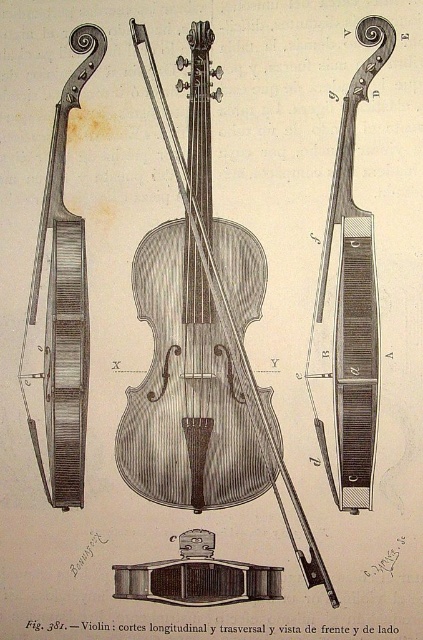
Question: Which object appears farthest from the camera in this image?

Choices:
 (A) matte wood violin at left
 (B) wooden violin at right
 (C) wooden violin at center

Answer: (A)

Question: Is wooden violin at center positioned in front of wooden violin at right?

Choices:
 (A) no
 (B) yes

Answer: (A)

Question: Does wooden violin at center have a lesser width compared to wooden violin at right?

Choices:
 (A) yes
 (B) no

Answer: (B)

Question: Which of these objects is positioned closest to the wooden violin at right?

Choices:
 (A) matte wood violin at left
 (B) wooden violin at center

Answer: (B)

Question: Observing the image, what is the correct spatial positioning of wooden violin at center in reference to wooden violin at right?

Choices:
 (A) right
 (B) left

Answer: (B)

Question: Which of the following is the farthest from the observer?

Choices:
 (A) matte wood violin at left
 (B) wooden violin at center
 (C) wooden violin at right

Answer: (A)